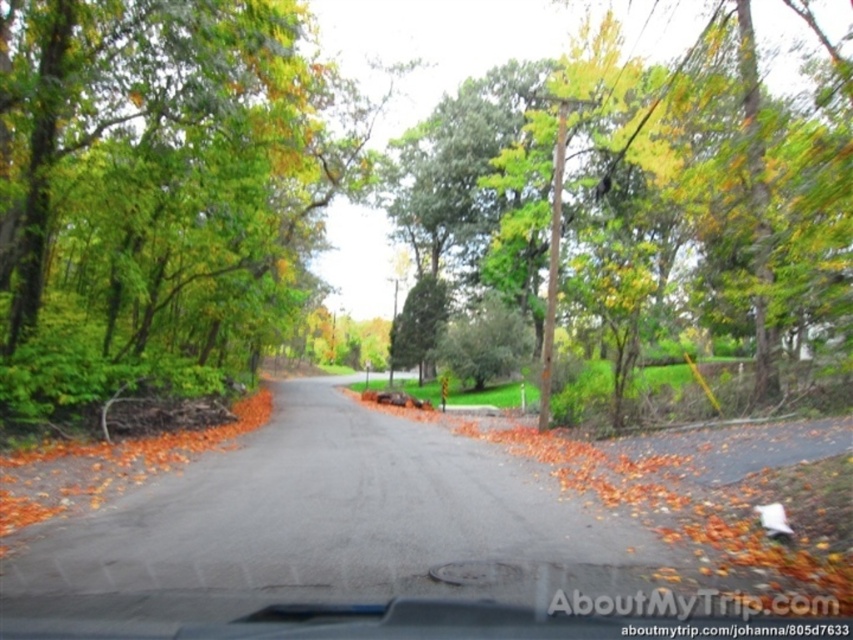
From the picture: Is green leafy tree at center closer to the viewer compared to orange leaf litter at center?

That is False.

Consider the image. Which of these two, green leafy tree at center or orange leaf litter at center, stands shorter?

orange leaf litter at center is shorter.

Locate an element on the screen. The width and height of the screenshot is (853, 640). green leafy tree at center is located at coordinates (669, 180).

Find the location of a particular element. green leafy tree at center is located at coordinates (669, 180).